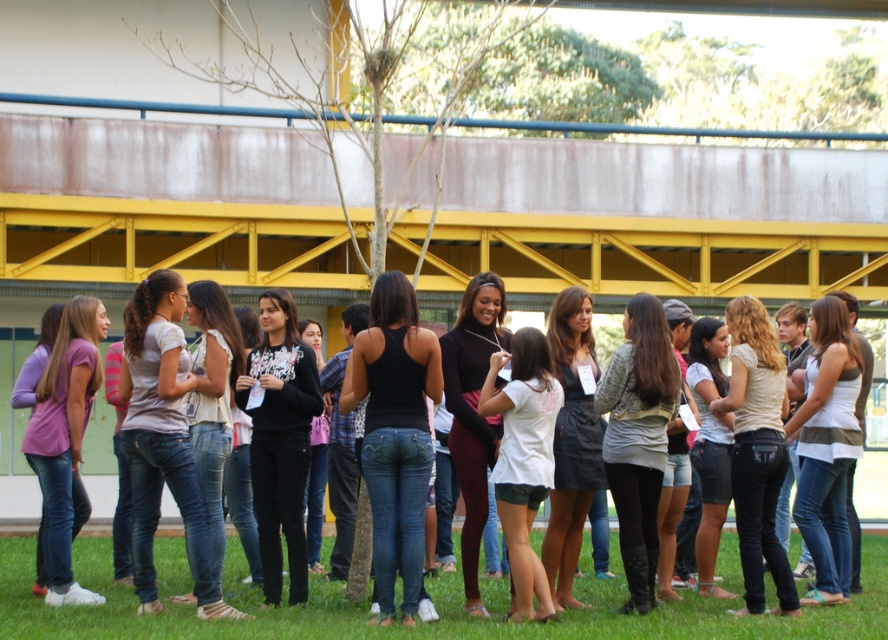
Question: Does black matte tank top at center have a smaller size compared to matte pink shirt at lower left?

Choices:
 (A) yes
 (B) no

Answer: (B)

Question: Can you confirm if black matte sweater at center is thinner than white jersey at center?

Choices:
 (A) yes
 (B) no

Answer: (A)

Question: Among these points, which one is nearest to the camera?

Choices:
 (A) (522, 490)
 (B) (48, 387)

Answer: (A)

Question: Can you confirm if white jersey at center is positioned above black turtleneck sweater at center?

Choices:
 (A) yes
 (B) no

Answer: (B)

Question: Estimate the real-world distances between objects in this image. Which object is farther from the gray textured sweater at center?

Choices:
 (A) dark denim dress at center
 (B) white jersey at center

Answer: (B)

Question: Which object is positioned closest to the gray textured sweater at center?

Choices:
 (A) matte pink shirt at lower left
 (B) dark denim dress at center

Answer: (B)